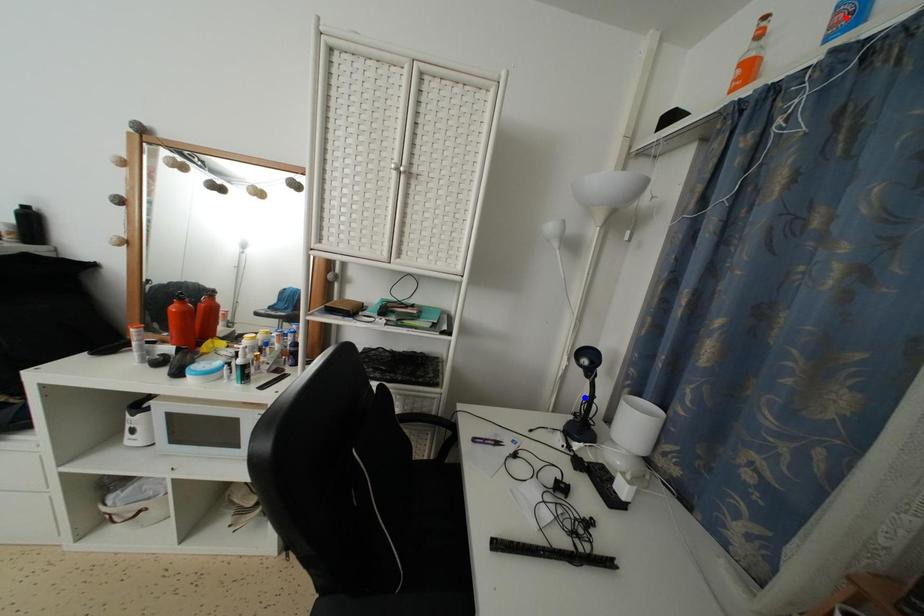
Question: Which of the two points in the image is closer to the camera?

Choices:
 (A) Blue point is closer.
 (B) Red point is closer.

Answer: (B)